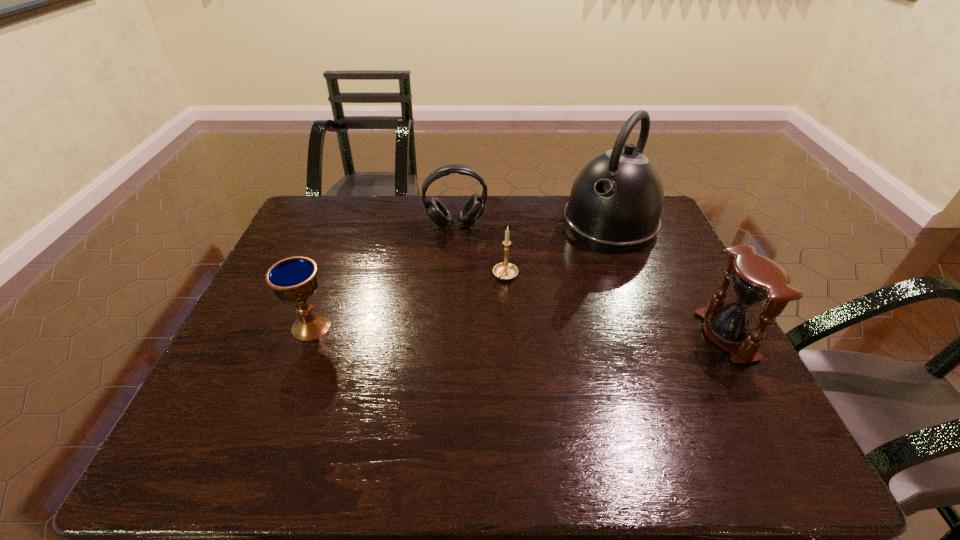
At what (x,y) coordinates should I click in order to perform the action: click on hourglass that is at the right edge. Please return your answer as a coordinate pair (x, y). The image size is (960, 540). Looking at the image, I should click on (754, 279).

Where is `kettle situated at the right edge`? kettle situated at the right edge is located at coordinates click(x=615, y=204).

This screenshot has width=960, height=540. I want to click on object at the far right corner, so click(x=615, y=204).

In the image, there is a desktop. Identify the location of free space at the far edge. (530, 231).

Locate an element on the screen. This screenshot has width=960, height=540. vacant space at the near edge of the desktop is located at coordinates (361, 410).

I want to click on free space at the right edge of the desktop, so click(663, 241).

The height and width of the screenshot is (540, 960). Identify the location of free location at the far left corner of the desktop. (353, 202).

Locate an element on the screen. This screenshot has height=540, width=960. vacant space at the near left corner of the desktop is located at coordinates (225, 397).

The image size is (960, 540). I want to click on free area in between the third object from right to left and the kettle, so click(558, 250).

Locate an element on the screen. This screenshot has width=960, height=540. free space between the kettle and the headset is located at coordinates (533, 224).